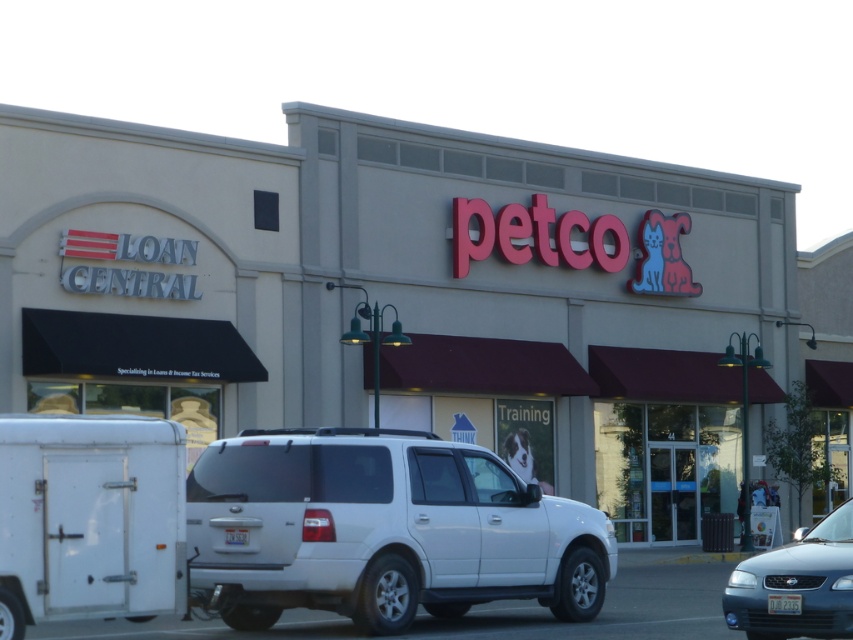
Between point (94, 438) and point (741, 627), which one is positioned behind?

Positioned behind is point (741, 627).

Can you confirm if white matte trailer at lower left is smaller than metallic blue sedan at lower right?

Actually, white matte trailer at lower left might be larger than metallic blue sedan at lower right.

Who is more distant from viewer, [107,572] or [817,532]?

Positioned behind is point [817,532].

Where is `white matte trailer at lower left`? The image size is (853, 640). white matte trailer at lower left is located at coordinates (90, 518).

Can you confirm if white matte minivan at center is positioned above white matte trailer at lower left?

No, white matte minivan at center is not above white matte trailer at lower left.

Is white matte minivan at center in front of white matte trailer at lower left?

No.

Is point (436, 609) more distant than point (108, 497)?

Yes, point (436, 609) is farther from viewer.

Identify the location of white matte minivan at center. The height and width of the screenshot is (640, 853). (381, 529).

What do you see at coordinates (381, 529) in the screenshot?
I see `white matte minivan at center` at bounding box center [381, 529].

Does white matte minivan at center appear under metallic blue sedan at lower right?

Correct, white matte minivan at center is located below metallic blue sedan at lower right.

Locate an element on the screen. white matte minivan at center is located at coordinates (381, 529).

Find the location of `white matte minivan at center`. white matte minivan at center is located at coordinates (381, 529).